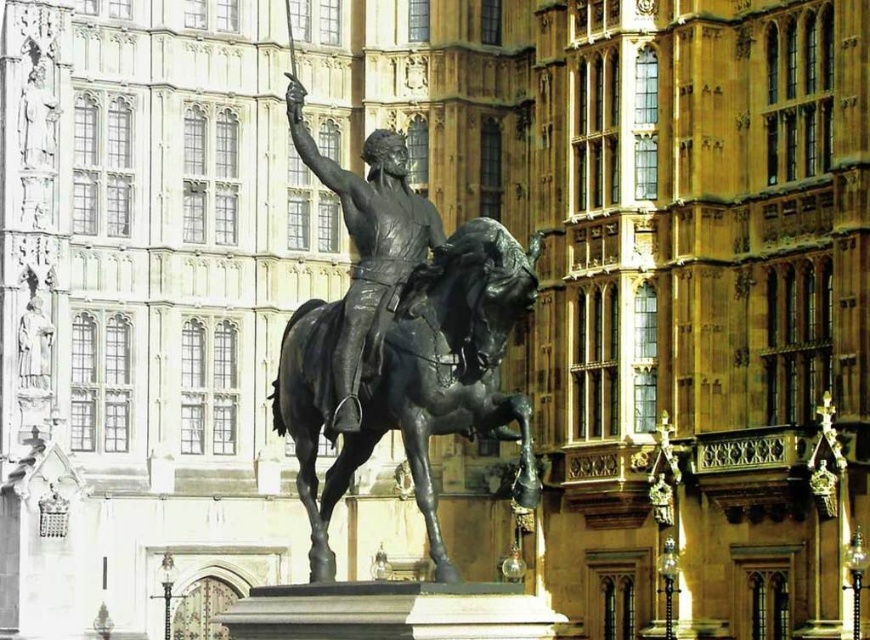
You are standing in front of the grand historic building and see the polished bronze horse at center and the polished bronze statue at center. Which object is located to the right of the other?

The polished bronze horse at center is positioned on the right side of the polished bronze statue at center.

You are standing in front of the equestrian statue and the historic building. You want to take a photo of the statue and the building. The camera you are using has a maximum focus range of 140 feet. Will the point at coordinates point (316, 358) be in focus?

The point at coordinates point (316, 358) is 139.90 feet from the camera, which is within the maximum focus range of 140 feet. Therefore, the point will be in focus.

You are an art student analyzing the equestrian statue in front of the historic building. You notice the polished bronze horse at center and the polished bronze statue at center. Which object is shorter in height?

The polished bronze horse at center is not as tall as the polished bronze statue at center, so the horse is shorter.